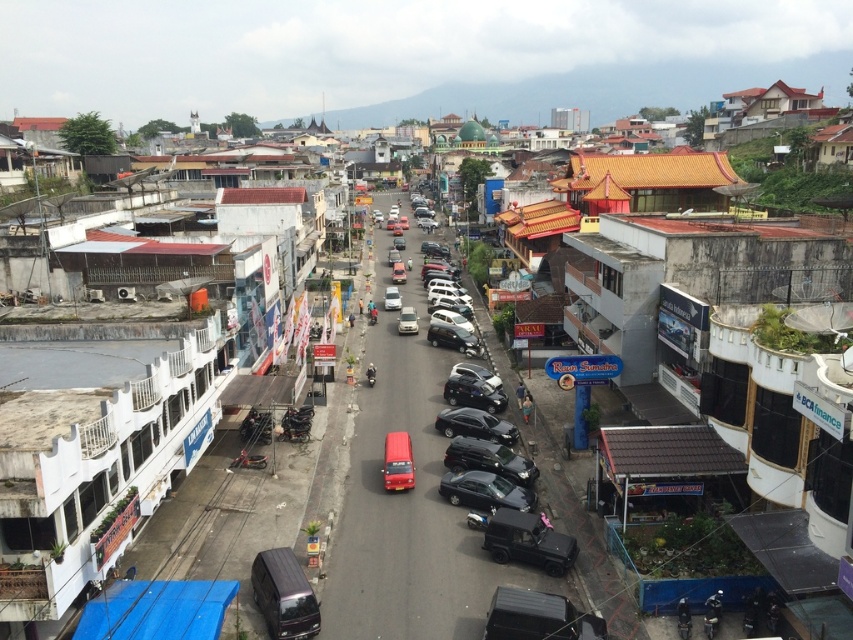
Is matte black car at center wider than matte silver van at center?

Yes.

Which is more to the right, matte black car at center or matte silver van at center?

Positioned to the right is matte black car at center.

Image resolution: width=853 pixels, height=640 pixels. Find the location of `matte black car at center`. matte black car at center is located at coordinates (410, 508).

Who is lower down, matte red bus at center or matte white van at center?

matte red bus at center is lower down.

Can you confirm if matte red bus at center is wider than matte white van at center?

No, matte red bus at center is not wider than matte white van at center.

Which is behind, point (405, 442) or point (397, 278)?

Positioned behind is point (397, 278).

Locate an element on the screen. The image size is (853, 640). matte red bus at center is located at coordinates (397, 461).

Between matte black car at center and metallic black van at center, which one appears on the left side from the viewer's perspective?

From the viewer's perspective, metallic black van at center appears more on the left side.

Who is shorter, matte black car at center or metallic black van at center?

metallic black van at center is shorter.

Find the location of a particular element. matte black car at center is located at coordinates (410, 508).